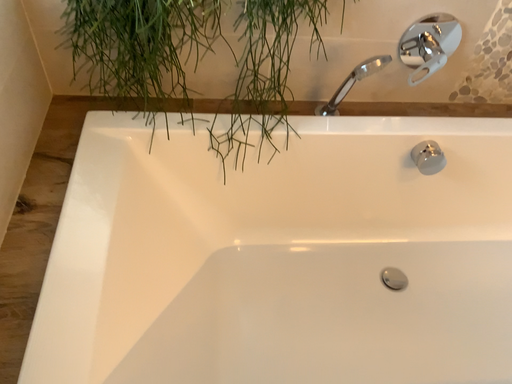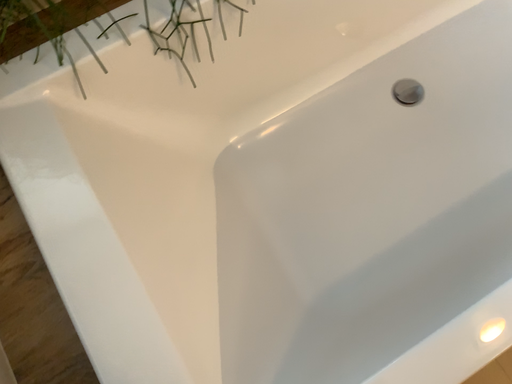
Question: Which way did the camera rotate in the video?

Choices:
 (A) rotated upward
 (B) rotated downward

Answer: (B)